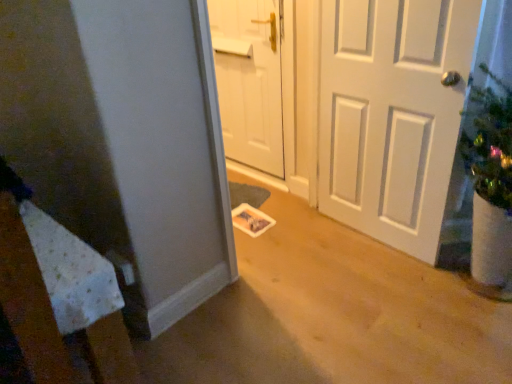
Question: From the image's perspective, is white matte door at center, placed as the 1th door when sorted from left to right, over white matte door at right, which ranks as the 1th door in right-to-left order?

Choices:
 (A) yes
 (B) no

Answer: (A)

Question: Considering the relative sizes of white matte door at center, placed as the 1th door when sorted from left to right, and white matte door at right, which ranks as the 1th door in right-to-left order, in the image provided, is white matte door at center, placed as the 1th door when sorted from left to right, taller than white matte door at right, which ranks as the 1th door in right-to-left order,?

Choices:
 (A) yes
 (B) no

Answer: (B)

Question: Does white matte door at center, which appears as the 2th door when viewed from the right, have a larger size compared to white matte door at right, which ranks as the 1th door in right-to-left order?

Choices:
 (A) no
 (B) yes

Answer: (A)

Question: Can you confirm if white matte door at center, placed as the 1th door when sorted from left to right, is wider than white matte door at right, the 2th door from the left?

Choices:
 (A) no
 (B) yes

Answer: (A)

Question: Considering the relative sizes of white matte door at center, placed as the 1th door when sorted from left to right, and white matte door at right, which ranks as the 1th door in right-to-left order, in the image provided, is white matte door at center, placed as the 1th door when sorted from left to right, thinner than white matte door at right, which ranks as the 1th door in right-to-left order,?

Choices:
 (A) yes
 (B) no

Answer: (A)

Question: Is white matte door at center, placed as the 1th door when sorted from left to right, with white matte door at right, which ranks as the 1th door in right-to-left order?

Choices:
 (A) no
 (B) yes

Answer: (A)

Question: Does white matte door at right, which ranks as the 1th door in right-to-left order, have a lesser height compared to white matte door at center, which appears as the 2th door when viewed from the right?

Choices:
 (A) yes
 (B) no

Answer: (B)

Question: From the image's perspective, would you say white matte door at right, which ranks as the 1th door in right-to-left order, is shown under white matte door at center, placed as the 1th door when sorted from left to right?

Choices:
 (A) no
 (B) yes

Answer: (B)

Question: From a real-world perspective, is white matte door at right, which ranks as the 1th door in right-to-left order, below white matte door at center, which appears as the 2th door when viewed from the right?

Choices:
 (A) no
 (B) yes

Answer: (A)

Question: Is white matte door at right, which ranks as the 1th door in right-to-left order, completely or partially outside of white matte door at center, placed as the 1th door when sorted from left to right?

Choices:
 (A) no
 (B) yes

Answer: (B)

Question: Is white matte door at right, the 2th door from the left, thinner than white matte door at center, placed as the 1th door when sorted from left to right?

Choices:
 (A) yes
 (B) no

Answer: (B)

Question: Is white matte door at right, the 2th door from the left, behind white matte door at center, placed as the 1th door when sorted from left to right?

Choices:
 (A) yes
 (B) no

Answer: (B)

Question: Looking at their shapes, would you say white matte door at right, which ranks as the 1th door in right-to-left order, is wider or thinner than white matte door at center, placed as the 1th door when sorted from left to right?

Choices:
 (A) thin
 (B) wide

Answer: (B)